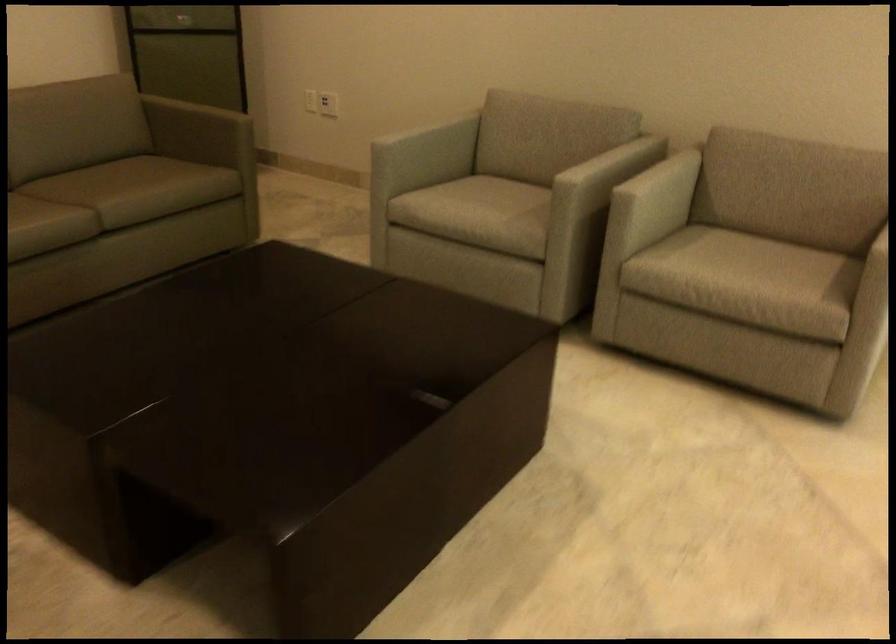
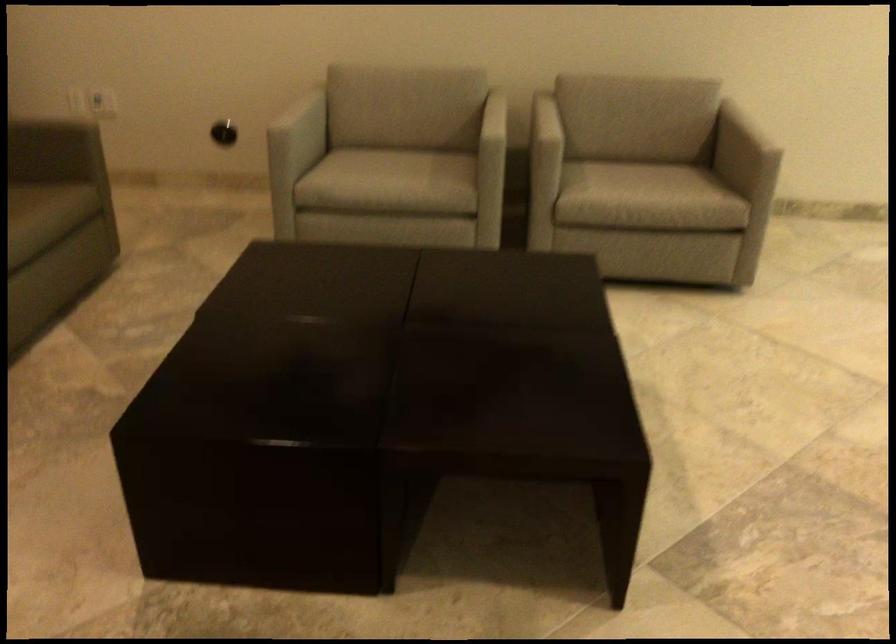
The point at (607, 200) is marked in the first image. Where is the corresponding point in the second image?

(545, 140)